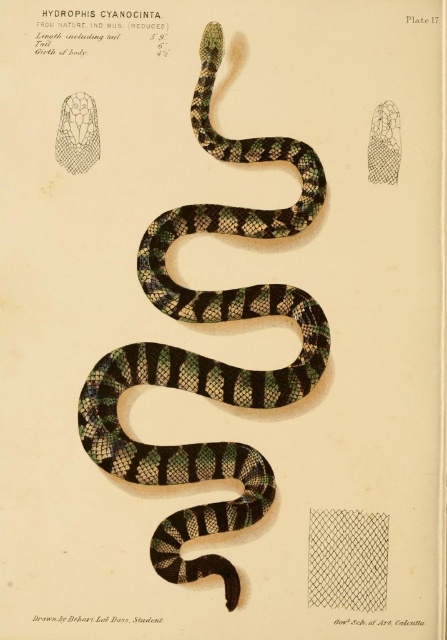
Based on the scene description, can you determine which object is positioned higher in the image between the green and black striped snake at center and the netted fabric at center?

The green and black striped snake at center is positioned above the netted fabric at center, so it is higher in the image.

Based on the scene description, which object is taller between the green and black striped snake at center and the netted fabric at center?

The green and black striped snake at center is much taller than the netted fabric at center according to the description.

You are a museum curator preparing to display the Hydrophis cyanocincta illustration. You need to ensure that the green and black striped snake at center and the netted fabric at center are visible to visitors. Based on their sizes, which object should you place closer to the front of the display case?

The green and black striped snake at center is wider than the netted fabric at center. To ensure both are visible, place the netted fabric at center closer to the front since it is narrower and less likely to block the view of the wider snake behind it.